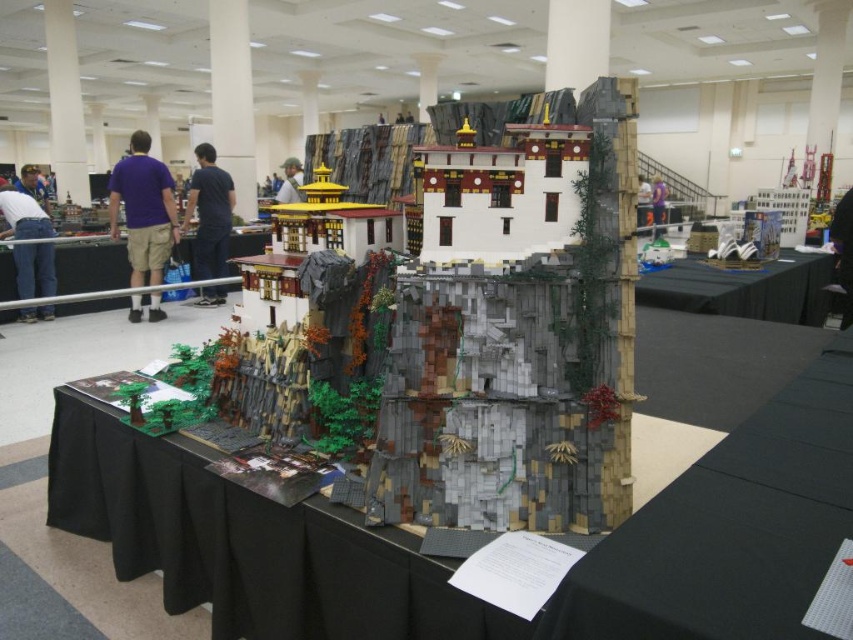
Looking at this image, you are a photographer at the exhibition and want to capture a photo of the black plastic table at center without any distractions. Since the purple cotton shirt at left is in the frame, will you need to adjust your camera angle to avoid it?

The purple cotton shirt at left is taller than the black plastic table at center, so adjusting the camera angle may be necessary to avoid capturing the shirt in the frame.

You are an architect examining a LEGO model of a traditional East Asian building at a convention. The model has a central brick structure. Where would you find the point located at coordinates (515, 328) in relation to the LEGO model?

The point at coordinates (515, 328) corresponds to the brick structure at the center of the LEGO model.